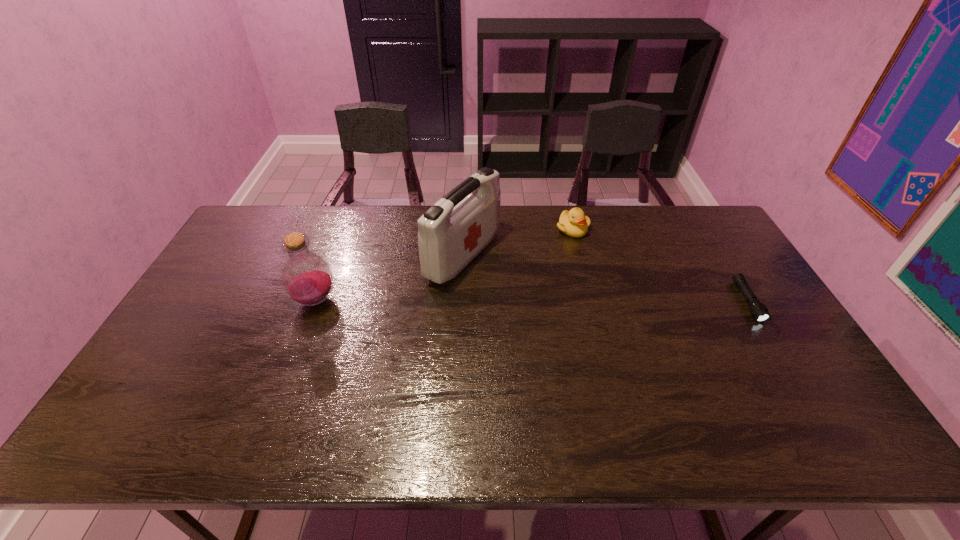
Where is `vacant space at the right edge of the desktop`? The width and height of the screenshot is (960, 540). vacant space at the right edge of the desktop is located at coordinates (729, 279).

Locate an element on the screen. This screenshot has height=540, width=960. vacant space at the far left corner of the desktop is located at coordinates (277, 207).

Identify the location of vacant space at the near left corner of the desktop. The image size is (960, 540). (132, 407).

Where is `free space at the far right corner of the desktop`? This screenshot has width=960, height=540. free space at the far right corner of the desktop is located at coordinates (663, 211).

Locate an element on the screen. The height and width of the screenshot is (540, 960). empty space that is in between the bottle and the first-aid kit is located at coordinates (390, 278).

Image resolution: width=960 pixels, height=540 pixels. I want to click on blank region between the leftmost object and the rightmost object, so click(x=532, y=301).

Where is `unoccupied area between the first-aid kit and the shortest object`? This screenshot has height=540, width=960. unoccupied area between the first-aid kit and the shortest object is located at coordinates (605, 279).

Where is `vacant area between the third object from right to left and the leftmost object`? vacant area between the third object from right to left and the leftmost object is located at coordinates (390, 278).

You are a GUI agent. You are given a task and a screenshot of the screen. Output one action in this format:
    pyautogui.click(x=<x>, y=<y>)
    Task: Click on the unoccupied position between the first-aid kit and the rightmost object
    This screenshot has width=960, height=540.
    Given the screenshot: What is the action you would take?
    pyautogui.click(x=605, y=279)

The height and width of the screenshot is (540, 960). Identify the location of vacant area between the flashlight and the bottle. (532, 301).